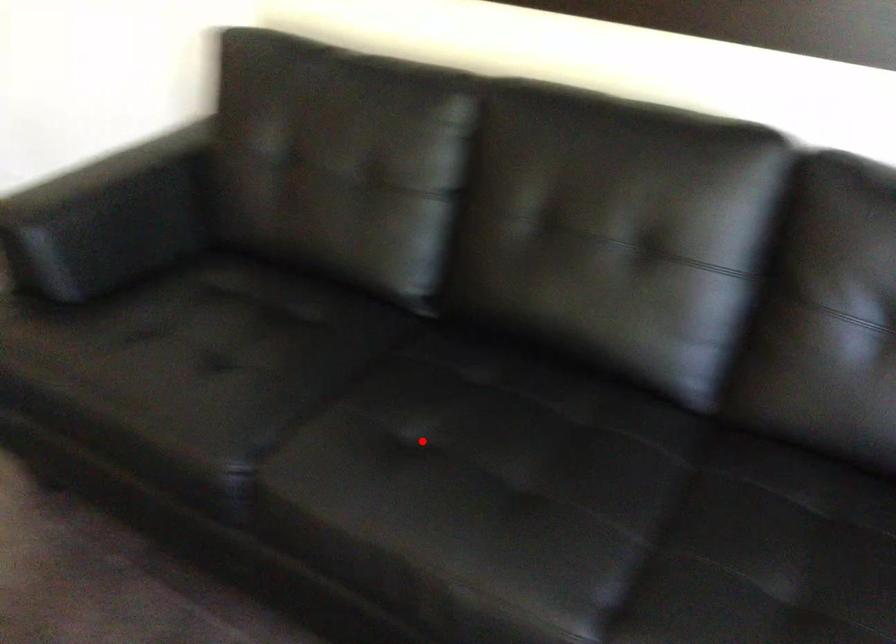
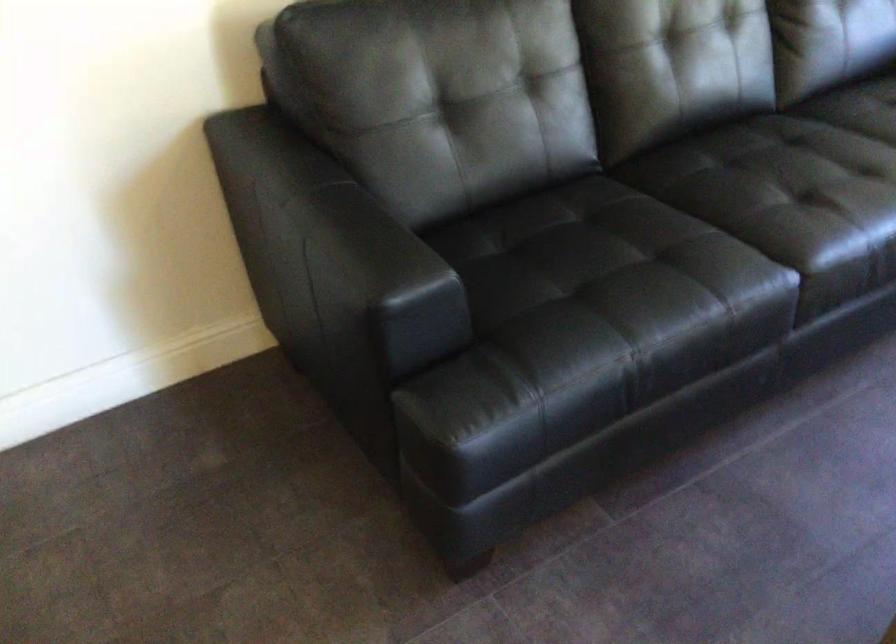
Question: A red point is marked in image1. In image2, is the corresponding 3D point closer to the camera or farther? Reply with the corresponding letter.

Choices:
 (A) The corresponding 3D point is closer.
 (B) The corresponding 3D point is farther.

Answer: (B)